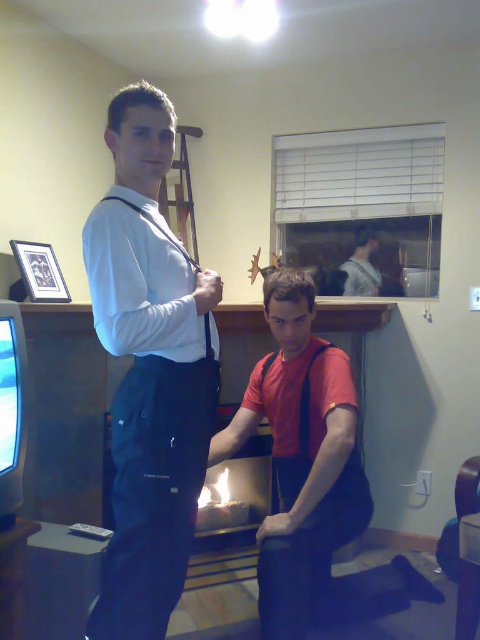
Between white matte shirt at center and matte black suspenders at upper left, which one has less height?

matte black suspenders at upper left

Can you confirm if white matte shirt at center is thinner than matte black suspenders at upper left?

Incorrect, white matte shirt at center's width is not less than matte black suspenders at upper left's.

Who is more forward, (151, 413) or (206, 360)?

Point (151, 413) is more forward.

Find the location of a particular element. white matte shirt at center is located at coordinates (149, 371).

Does smooth gray shirt at center come behind matte black suspenders at upper left?

Yes, it is.

Between smooth gray shirt at center and matte black suspenders at upper left, which one is positioned lower?

matte black suspenders at upper left

Which is in front, point (347, 266) or point (208, 321)?

Positioned in front is point (208, 321).

Where is `smooth gray shirt at center`? The width and height of the screenshot is (480, 640). smooth gray shirt at center is located at coordinates (361, 266).

Is white matte shirt at center bigger than smooth gray shirt at center?

Yes, white matte shirt at center is bigger than smooth gray shirt at center.

Can you confirm if white matte shirt at center is positioned above smooth gray shirt at center?

No.

The width and height of the screenshot is (480, 640). Identify the location of white matte shirt at center. (149, 371).